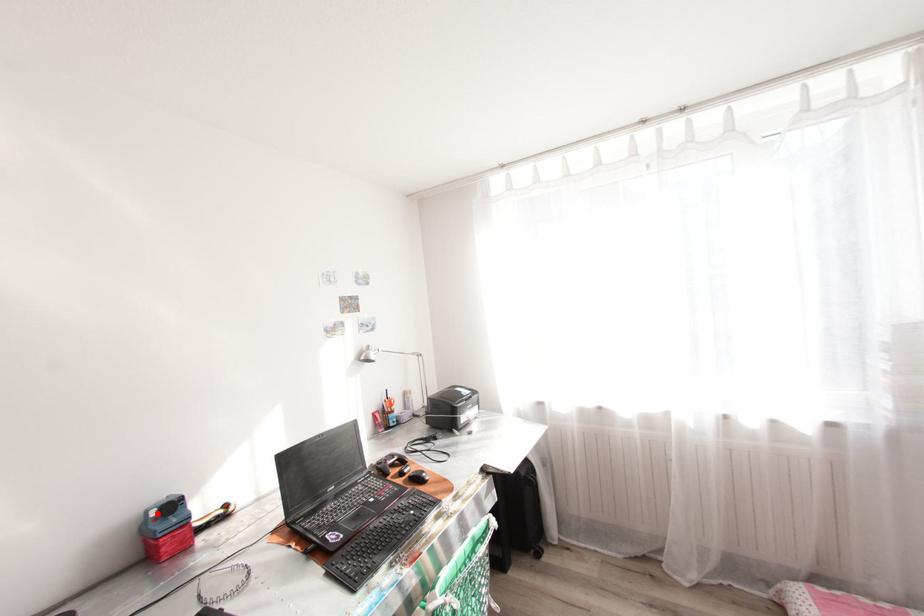
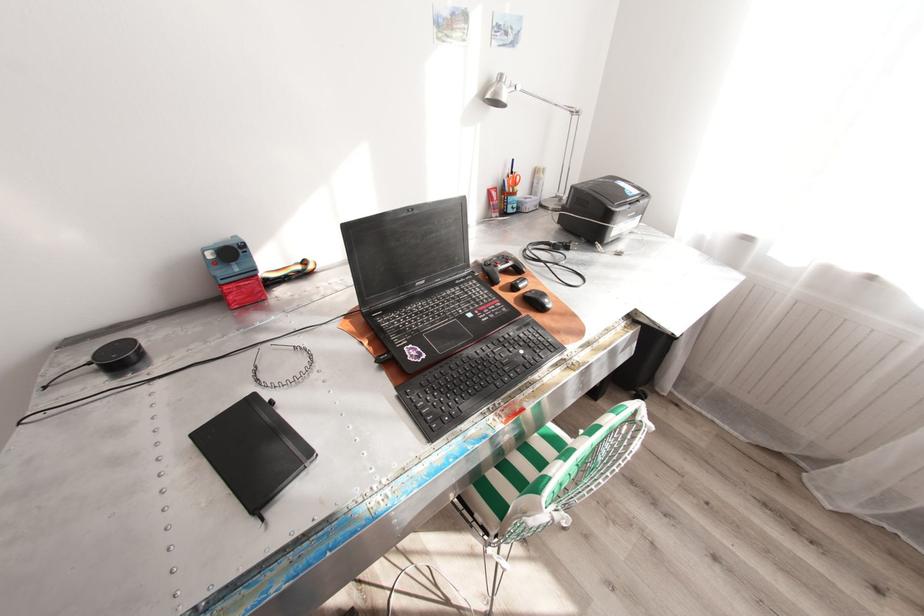
In the second image, find the point that corresponds to the highlighted location in the first image.

(215, 254)